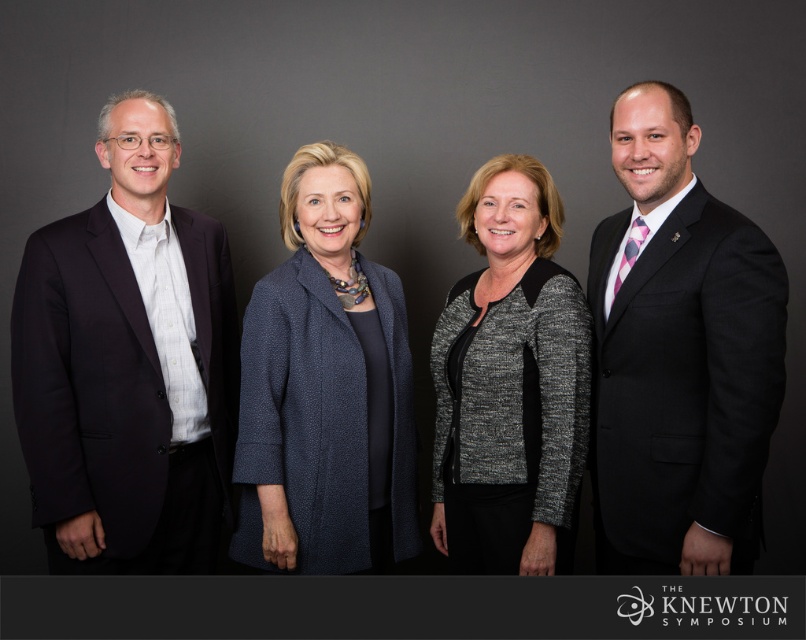
Which of these two, dark blue suit at left or blue textured coat at center, stands taller?

dark blue suit at left is taller.

Is dark blue suit at left in front of blue textured coat at center?

Yes, dark blue suit at left is closer to the viewer.

Between point (100, 125) and point (339, 305), which one is positioned behind?

Point (100, 125)

Locate an element on the screen. The image size is (806, 640). dark blue suit at left is located at coordinates pyautogui.click(x=127, y=365).

Is dark blue suit at left wider than black suit at right?

Indeed, dark blue suit at left has a greater width compared to black suit at right.

Does dark blue suit at left lie behind black suit at right?

Yes, dark blue suit at left is further from the viewer.

Who is more distant from viewer, (158, 360) or (638, 266)?

The point (158, 360) is more distant.

Locate an element on the screen. Image resolution: width=806 pixels, height=640 pixels. dark blue suit at left is located at coordinates (x=127, y=365).

Is point (181, 509) more distant than point (489, 388)?

Yes, it is behind point (489, 388).

Describe the element at coordinates (127, 365) in the screenshot. Image resolution: width=806 pixels, height=640 pixels. I see `dark blue suit at left` at that location.

Where is `dark blue suit at left`? The height and width of the screenshot is (640, 806). dark blue suit at left is located at coordinates [x=127, y=365].